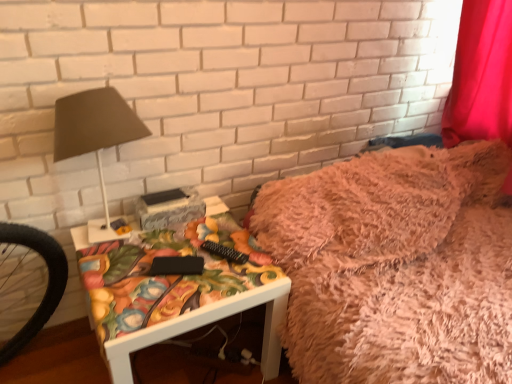
Question: From the image's perspective, is matte floral-patterned side table at center under fuzzy pink blanket at upper right?

Choices:
 (A) no
 (B) yes

Answer: (B)

Question: Is matte floral-patterned side table at center facing towards fuzzy pink blanket at upper right?

Choices:
 (A) no
 (B) yes

Answer: (A)

Question: Is matte floral-patterned side table at center positioned in front of fuzzy pink blanket at upper right?

Choices:
 (A) no
 (B) yes

Answer: (B)

Question: Are matte floral-patterned side table at center and fuzzy pink blanket at upper right far apart?

Choices:
 (A) yes
 (B) no

Answer: (B)

Question: Can you confirm if matte floral-patterned side table at center is positioned to the right of fuzzy pink blanket at upper right?

Choices:
 (A) no
 (B) yes

Answer: (A)

Question: From a real-world perspective, is matte floral-patterned side table at center positioned above or below matte brown lampshade at left?

Choices:
 (A) below
 (B) above

Answer: (A)

Question: Is matte floral-patterned side table at center inside or outside of matte brown lampshade at left?

Choices:
 (A) inside
 (B) outside

Answer: (B)

Question: From the image's perspective, is matte floral-patterned side table at center above or below matte brown lampshade at left?

Choices:
 (A) below
 (B) above

Answer: (A)

Question: Based on their positions, is matte floral-patterned side table at center located to the left or right of matte brown lampshade at left?

Choices:
 (A) right
 (B) left

Answer: (A)

Question: From the image's perspective, is matte brown lampshade at left above or below fuzzy pink blanket at upper right?

Choices:
 (A) below
 (B) above

Answer: (B)

Question: In terms of width, does matte brown lampshade at left look wider or thinner when compared to fuzzy pink blanket at upper right?

Choices:
 (A) thin
 (B) wide

Answer: (A)

Question: Considering the positions of matte brown lampshade at left and fuzzy pink blanket at upper right in the image, is matte brown lampshade at left bigger or smaller than fuzzy pink blanket at upper right?

Choices:
 (A) small
 (B) big

Answer: (A)

Question: In the image, is matte brown lampshade at left on the left side or the right side of fuzzy pink blanket at upper right?

Choices:
 (A) right
 (B) left

Answer: (B)

Question: From the image's perspective, is matte brown lampshade at left above or below matte floral-patterned side table at center?

Choices:
 (A) above
 (B) below

Answer: (A)

Question: Considering the positions of point (67, 130) and point (117, 364), is point (67, 130) closer or farther from the camera than point (117, 364)?

Choices:
 (A) farther
 (B) closer

Answer: (A)